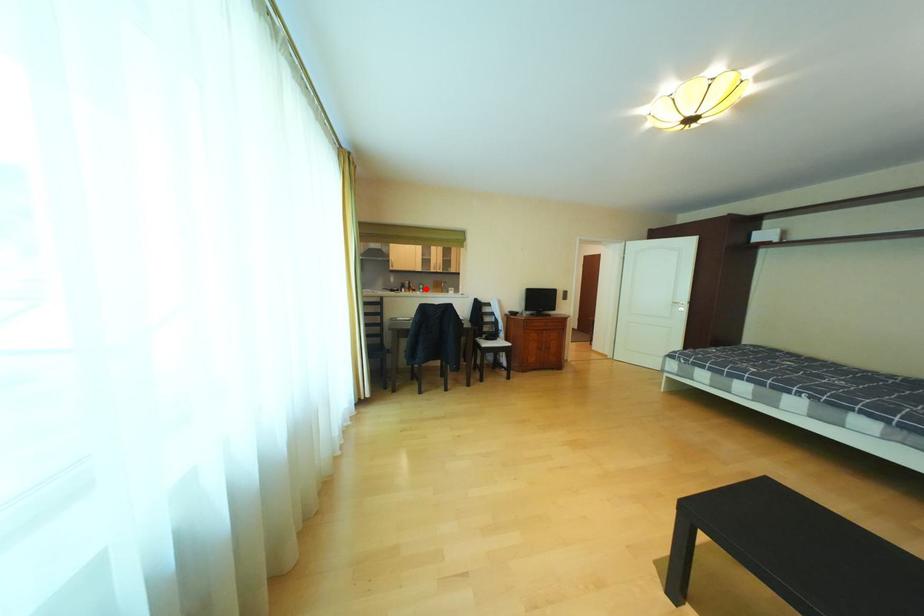
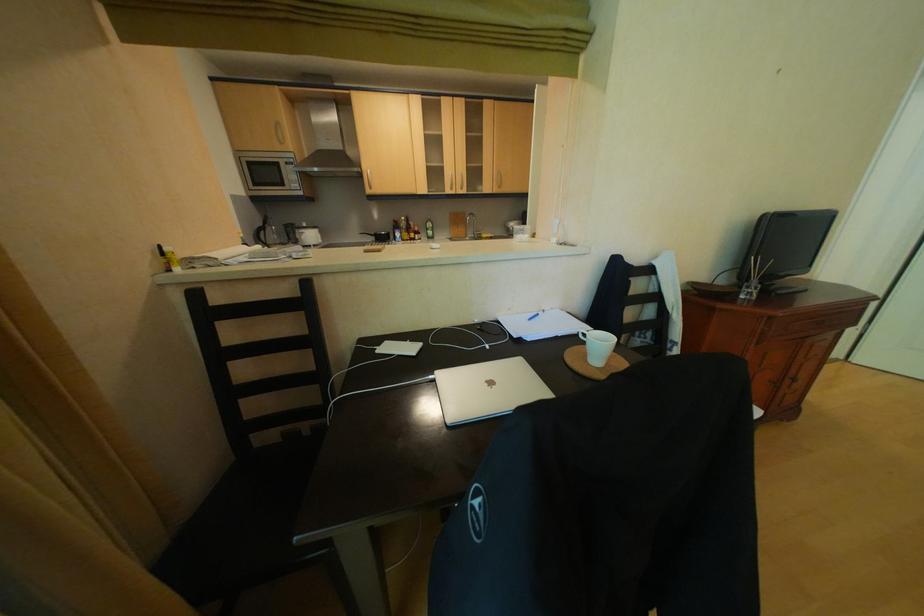
Where in the second image is the point corresponding to the highlighted location from the first image?

(429, 230)